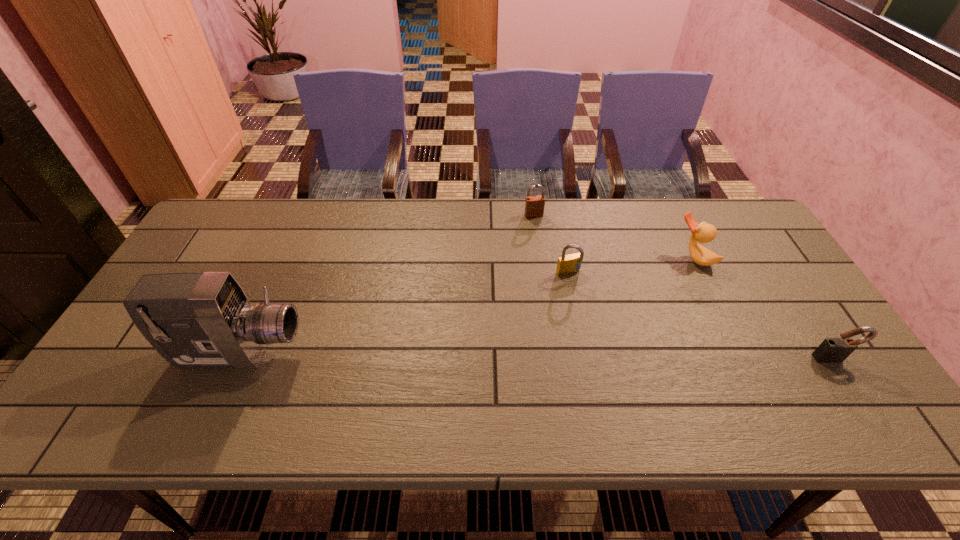
At what (x,y) coordinates should I click in order to perform the action: click on empty space between the farthest padlock and the tallest object. Please return your answer as a coordinate pair (x, y). This screenshot has height=540, width=960. Looking at the image, I should click on (387, 285).

Where is `unoccupied area between the tallest object and the second padlock from left to right`? This screenshot has height=540, width=960. unoccupied area between the tallest object and the second padlock from left to right is located at coordinates (404, 313).

Where is `empty space between the tallest object and the second farthest padlock`? This screenshot has height=540, width=960. empty space between the tallest object and the second farthest padlock is located at coordinates (404, 313).

The height and width of the screenshot is (540, 960). Identify the location of empty location between the second object from left to right and the rightmost padlock. (684, 287).

Select which object is the closest to the second nearest padlock. Please provide its 2D coordinates. Your answer should be formatted as a tuple, i.e. [(x, y)], where the tuple contains the x and y coordinates of a point satisfying the conditions above.

[(534, 205)]

The width and height of the screenshot is (960, 540). I want to click on object that stands as the fourth closest to the second farthest padlock, so click(x=195, y=320).

Identify which padlock is located as the nearest to the fourth object from left to right. Please provide its 2D coordinates. Your answer should be formatted as a tuple, i.e. [(x, y)], where the tuple contains the x and y coordinates of a point satisfying the conditions above.

[(569, 264)]

Where is `padlock identified as the second closest to the rightmost object`? The width and height of the screenshot is (960, 540). padlock identified as the second closest to the rightmost object is located at coordinates (534, 205).

The image size is (960, 540). Find the location of `vacant point that satisfies the following two spatial constraints: 1. on the front side of the second object from right to left; 2. on the left side of the farthest object`. vacant point that satisfies the following two spatial constraints: 1. on the front side of the second object from right to left; 2. on the left side of the farthest object is located at coordinates click(540, 258).